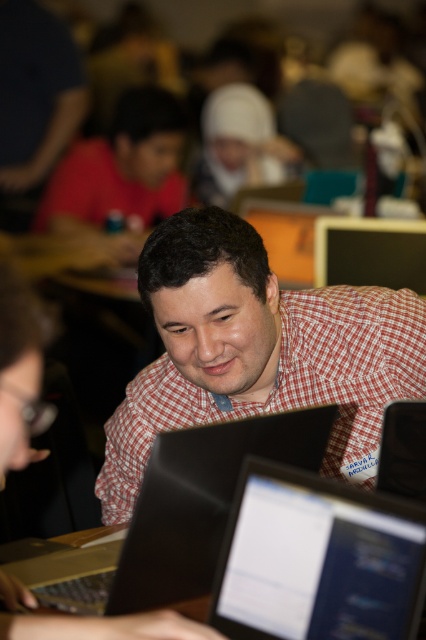
Question: Is red checkered shirt at center to the left of matte black laptop at center from the viewer's perspective?

Choices:
 (A) no
 (B) yes

Answer: (B)

Question: Is black matte laptop at center bigger than matte black monitor at upper center?

Choices:
 (A) no
 (B) yes

Answer: (B)

Question: Does red checkered shirt at center lie in front of black matte laptop at center?

Choices:
 (A) no
 (B) yes

Answer: (A)

Question: Estimate the real-world distances between objects in this image. Which object is farther from the matte black monitor at upper center?

Choices:
 (A) matte red shirt at upper left
 (B) matte black laptop at center
 (C) red checkered shirt at center

Answer: (B)

Question: Which object is positioned closest to the red checkered shirt at center?

Choices:
 (A) matte black monitor at upper center
 (B) matte black laptop at center
 (C) matte red shirt at upper left

Answer: (B)

Question: Among these objects, which one is farthest from the camera?

Choices:
 (A) matte black monitor at upper center
 (B) matte red shirt at upper left

Answer: (B)